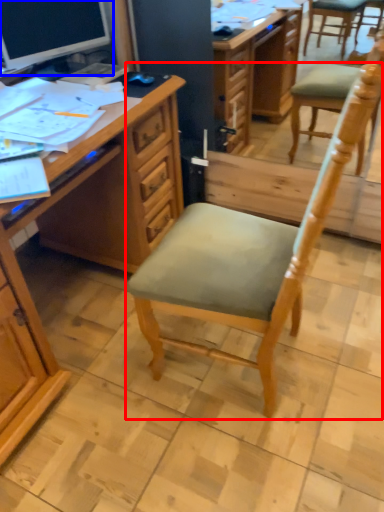
Question: Which object is further to the camera taking this photo, chair (highlighted by a red box) or computer monitor (highlighted by a blue box)?

Choices:
 (A) chair
 (B) computer monitor

Answer: (B)